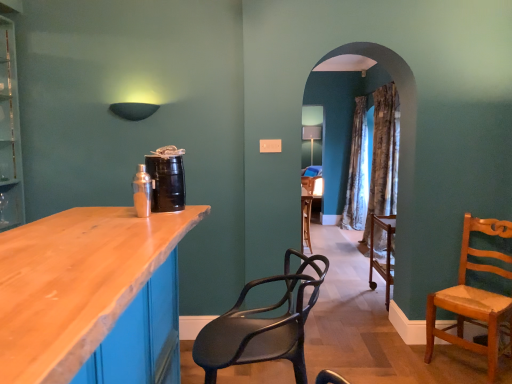
Question: Is matte black chair at center, which is counted as the 2th chair, starting from the back, bigger or smaller than patterned fabric curtain at center?

Choices:
 (A) big
 (B) small

Answer: (B)

Question: From the image's perspective, relative to patterned fabric curtain at center, is matte black chair at center, which is counted as the first chair, starting from the left, above or below?

Choices:
 (A) above
 (B) below

Answer: (B)

Question: Which object is the farthest from the light brown wooden chair at right, acting as the second chair starting from the front?

Choices:
 (A) patterned fabric curtain at center
 (B) matte black chair at center, which is counted as the 2th chair, starting from the back

Answer: (A)

Question: Based on their relative distances, which object is nearer to the patterned fabric curtain at center?

Choices:
 (A) matte black chair at center, which is the first chair from front to back
 (B) light brown wooden chair at right, marked as the 1th chair in a right-to-left arrangement

Answer: (B)